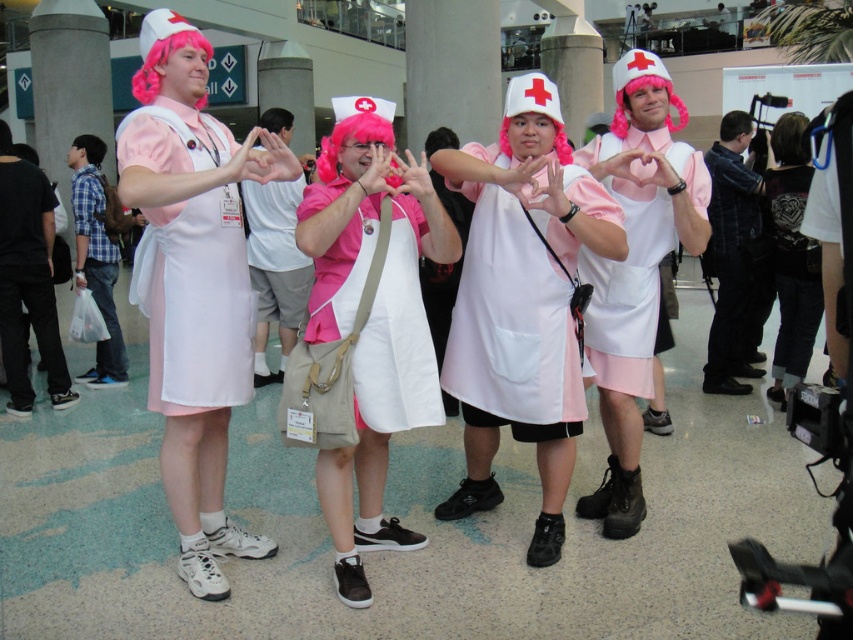
You are a photographer standing at the back of the convention center. You want to take a photo that includes both the matte white apron at center and the pink synthetic wig at upper left without any obstruction. Given that your camera has a maximum focus range of 1.1 meters, will you be able to capture both objects in focus?

The distance between the matte white apron at center and the pink synthetic wig at upper left is 1.09 meters. Since the camera can focus up to 1.1 meters, both objects are within the focus range, so yes, you can capture both in focus.